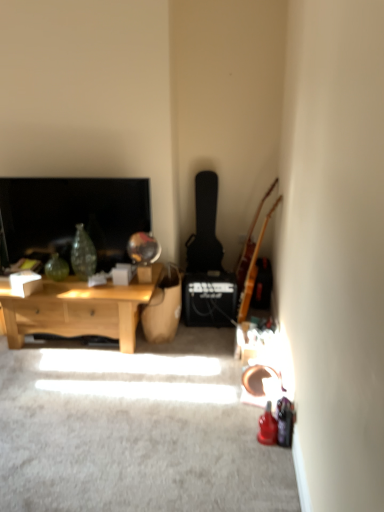
What are the coordinates of `matte black television at left` in the screenshot? It's located at (73, 216).

What do you see at coordinates (78, 310) in the screenshot? Image resolution: width=384 pixels, height=512 pixels. I see `light wood coffee table at left` at bounding box center [78, 310].

What do you see at coordinates (253, 269) in the screenshot? I see `light brown wooden guitar at right, which appears as the second guitar when viewed from the left` at bounding box center [253, 269].

Identify the location of black matte guitar at center-right, the 1th guitar when ordered from left to right. Image resolution: width=384 pixels, height=512 pixels. (205, 227).

From a real-world perspective, is light brown wooden guitar at right, which appears as the 1th guitar when viewed from the right, above or below black matte guitar at center-right, which is the 2th guitar in right-to-left order?

light brown wooden guitar at right, which appears as the 1th guitar when viewed from the right, is situated lower than black matte guitar at center-right, which is the 2th guitar in right-to-left order, in the real world.

From the image's perspective, is light brown wooden guitar at right, which appears as the second guitar when viewed from the left, on top of black matte guitar at center-right, the 1th guitar when ordered from left to right?

Incorrect, from the image's perspective, light brown wooden guitar at right, which appears as the second guitar when viewed from the left, is lower than black matte guitar at center-right, the 1th guitar when ordered from left to right.

In the image, there is a black matte guitar at center-right, the 1th guitar when ordered from left to right. Identify the location of guitar below it (from a real-world perspective). (253, 269).

Is light brown wooden guitar at right, which appears as the 1th guitar when viewed from the right, to the left of black matte guitar at center-right, the 1th guitar when ordered from left to right, from the viewer's perspective?

Incorrect, light brown wooden guitar at right, which appears as the 1th guitar when viewed from the right, is not on the left side of black matte guitar at center-right, the 1th guitar when ordered from left to right.

From the image's perspective, would you say light wood coffee table at left is positioned over black matte guitar at center-right, which is the 2th guitar in right-to-left order?

No, from the image's perspective, light wood coffee table at left is not over black matte guitar at center-right, which is the 2th guitar in right-to-left order.

From a real-world perspective, is light wood coffee table at left located beneath black matte guitar at center-right, the 1th guitar when ordered from left to right?

Yes, from a real-world perspective, light wood coffee table at left is beneath black matte guitar at center-right, the 1th guitar when ordered from left to right.

Locate an element on the screen. The width and height of the screenshot is (384, 512). guitar that is the 2nd one when counting upward from the light wood coffee table at left (from the image's perspective) is located at coordinates (205, 227).

Is light wood coffee table at left with matte black television at left?

No, light wood coffee table at left is not beside matte black television at left.

Considering the sizes of objects light wood coffee table at left and matte black television at left in the image provided, who is bigger, light wood coffee table at left or matte black television at left?

Bigger between the two is light wood coffee table at left.

In the scene shown: Does light wood coffee table at left come in front of matte black television at left?

Yes, light wood coffee table at left is in front of matte black television at left.

Looking at this image, from a real-world perspective, does matte black television at left stand above light wood coffee table at left?

Yes, from a real-world perspective, matte black television at left is on top of light wood coffee table at left.

Considering the sizes of matte black television at left and light wood coffee table at left in the image, is matte black television at left taller or shorter than light wood coffee table at left?

In the image, matte black television at left appears to be taller than light wood coffee table at left.

Considering the sizes of objects matte black television at left and light wood coffee table at left in the image provided, who is wider, matte black television at left or light wood coffee table at left?

With larger width is light wood coffee table at left.

Considering the sizes of objects matte black television at left and light wood coffee table at left in the image provided, who is smaller, matte black television at left or light wood coffee table at left?

With smaller size is matte black television at left.

This screenshot has height=512, width=384. Find the location of `fireplace above the light brown wooden guitar at right, which appears as the 1th guitar when viewed from the right (from the image's perspective)`. fireplace above the light brown wooden guitar at right, which appears as the 1th guitar when viewed from the right (from the image's perspective) is located at coordinates (73, 216).

From the image's perspective, between matte black television at left and light brown wooden guitar at right, which appears as the second guitar when viewed from the left, which one is located above?

matte black television at left, from the image's perspective.

Consider the image. Is matte black television at left situated inside light brown wooden guitar at right, which appears as the second guitar when viewed from the left, or outside?

matte black television at left is not inside light brown wooden guitar at right, which appears as the second guitar when viewed from the left, it's outside.

Which object is thinner, matte black television at left or light brown wooden guitar at right, which appears as the second guitar when viewed from the left?

With smaller width is matte black television at left.

Is point (240, 303) more distant than point (2, 192)?

Yes, point (240, 303) is farther from viewer.

Consider the image. Is light brown wooden guitar at right, which appears as the second guitar when viewed from the left, behind matte black television at left?

No, light brown wooden guitar at right, which appears as the second guitar when viewed from the left, is in front of matte black television at left.

From the image's perspective, which is above, light brown wooden guitar at right, which appears as the second guitar when viewed from the left, or matte black television at left?

From the image's view, matte black television at left is above.

Which is more to the right, light brown wooden guitar at right, which appears as the second guitar when viewed from the left, or matte black television at left?

From the viewer's perspective, light brown wooden guitar at right, which appears as the second guitar when viewed from the left, appears more on the right side.

From the image's perspective, is light wood coffee table at left on top of light brown wooden guitar at right, which appears as the second guitar when viewed from the left?

Actually, light wood coffee table at left appears below light brown wooden guitar at right, which appears as the second guitar when viewed from the left, in the image.

Measure the distance from light wood coffee table at left to light brown wooden guitar at right, which appears as the second guitar when viewed from the left.

The distance of light wood coffee table at left from light brown wooden guitar at right, which appears as the second guitar when viewed from the left, is 3.45 feet.

Is light wood coffee table at left oriented towards light brown wooden guitar at right, which appears as the second guitar when viewed from the left?

No.

Find the location of `guitar below the black matte guitar at center-right, the 1th guitar when ordered from left to right (from a real-world perspective)`. guitar below the black matte guitar at center-right, the 1th guitar when ordered from left to right (from a real-world perspective) is located at coordinates (253, 269).

From a real-world perspective, which guitar is the 2nd one above the light wood coffee table at left? Please provide its 2D coordinates.

[(205, 227)]

When comparing their distances from light wood coffee table at left, does black matte guitar at center-right, which is the 2th guitar in right-to-left order, or matte black television at left seem closer?

Among the two, matte black television at left is located nearer to light wood coffee table at left.

Estimate the real-world distances between objects in this image. Which object is closer to black matte guitar at center-right, the 1th guitar when ordered from left to right, light brown wooden guitar at right, which appears as the second guitar when viewed from the left, or light wood coffee table at left?

light brown wooden guitar at right, which appears as the second guitar when viewed from the left, is closer to black matte guitar at center-right, the 1th guitar when ordered from left to right.

Based on their spatial positions, is light wood coffee table at left or light brown wooden guitar at right, which appears as the 1th guitar when viewed from the right, further from black matte guitar at center-right, the 1th guitar when ordered from left to right?

light wood coffee table at left lies further to black matte guitar at center-right, the 1th guitar when ordered from left to right, than the other object.

From the image, which object appears to be farther from light brown wooden guitar at right, which appears as the 1th guitar when viewed from the right, matte black television at left or light wood coffee table at left?

matte black television at left lies further to light brown wooden guitar at right, which appears as the 1th guitar when viewed from the right, than the other object.

Looking at the image, which one is located further to black matte guitar at center-right, which is the 2th guitar in right-to-left order, matte black television at left or light wood coffee table at left?

Based on the image, light wood coffee table at left appears to be further to black matte guitar at center-right, which is the 2th guitar in right-to-left order.

Based on their spatial positions, is matte black television at left or light brown wooden guitar at right, which appears as the second guitar when viewed from the left, closer to black matte guitar at center-right, the 1th guitar when ordered from left to right?

light brown wooden guitar at right, which appears as the second guitar when viewed from the left, is closer to black matte guitar at center-right, the 1th guitar when ordered from left to right.

From the image, which object appears to be farther from light wood coffee table at left, matte black television at left or light brown wooden guitar at right, which appears as the second guitar when viewed from the left?

light brown wooden guitar at right, which appears as the second guitar when viewed from the left.

Looking at the image, which one is located closer to light wood coffee table at left, light brown wooden guitar at right, which appears as the 1th guitar when viewed from the right, or matte black television at left?

matte black television at left is positioned closer to the anchor light wood coffee table at left.

Image resolution: width=384 pixels, height=512 pixels. Identify the location of guitar located between matte black television at left and light brown wooden guitar at right, which appears as the second guitar when viewed from the left, in the left-right direction. (205, 227).

This screenshot has height=512, width=384. I want to click on desk between matte black television at left and light brown wooden guitar at right, which appears as the second guitar when viewed from the left, in the horizontal direction, so click(x=78, y=310).

This screenshot has height=512, width=384. I want to click on guitar located between light wood coffee table at left and light brown wooden guitar at right, which appears as the 1th guitar when viewed from the right, in the left-right direction, so click(x=205, y=227).

At what (x,y) coordinates should I click in order to perform the action: click on desk situated between matte black television at left and black matte guitar at center-right, which is the 2th guitar in right-to-left order, from left to right. Please return your answer as a coordinate pair (x, y). Looking at the image, I should click on (78, 310).